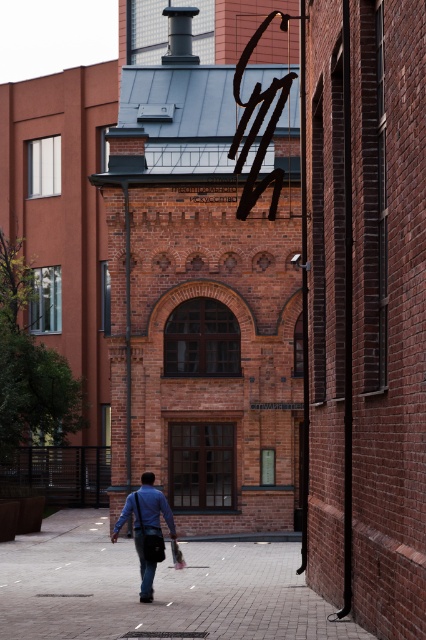
You are standing in front of the brick building and want to place a blue fabric bag at center on the brick pavement at center. Can you place the bag directly on the pavement without moving any objects?

The brick pavement at center is closer to the viewer than the blue fabric bag at center, so the blue fabric bag at center is actually behind the pavement. Therefore, you cannot place the bag directly on the pavement without moving it forward.

You are standing 50 feet away from a historic brick building with a modern black pipe on its right side. There is a point marked at coordinates (187, 595) on the building. Can you determine if this point is closer to you than the pipe?

The point at coordinates (187, 595) is 49.88 feet away from the viewer, which is slightly less than 50 feet. Therefore, the point is closer to you than the pipe, which is on the right side of the building.

You are a delivery person trying to place a blue fabric bag at center on the brick pavement at center. Can you place the bag directly on the pavement without it hanging?

The brick pavement at center is positioned under blue fabric bag at center, so yes, you can place the blue fabric bag at center directly on the brick pavement at center since it is located underneath it.